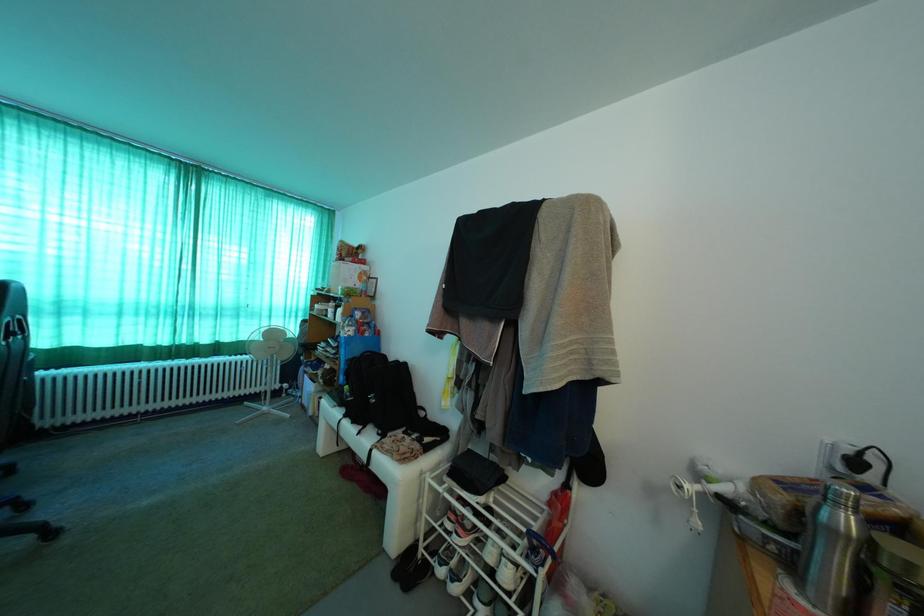
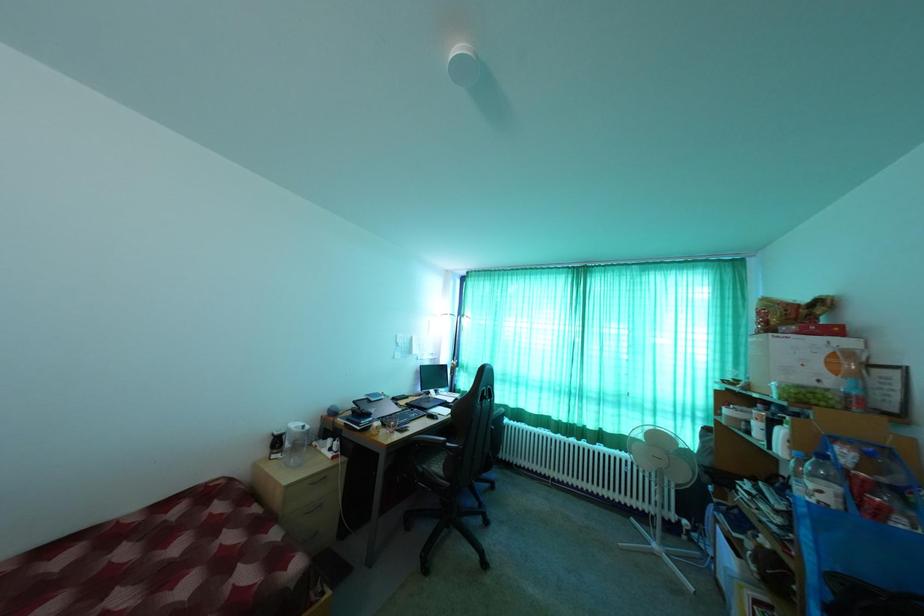
Question: The camera is either moving clockwise (left) or counter-clockwise (right) around the object. The first image is from the beginning of the video and the second image is from the end. Is the camera moving left or right when shooting the video?

Choices:
 (A) Left
 (B) Right

Answer: (B)